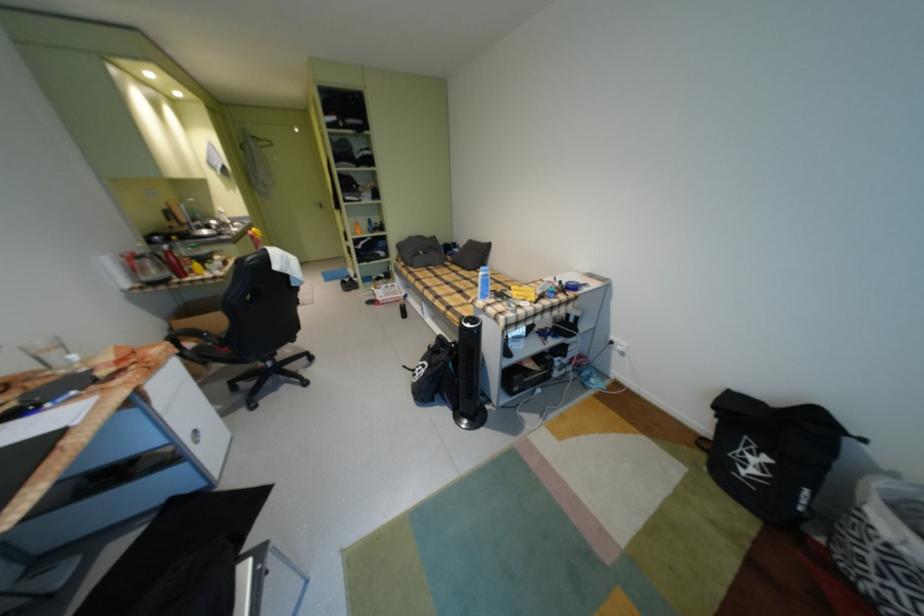
The image size is (924, 616). What are the coordinates of `chair armrest` in the screenshot? It's located at (270, 371).